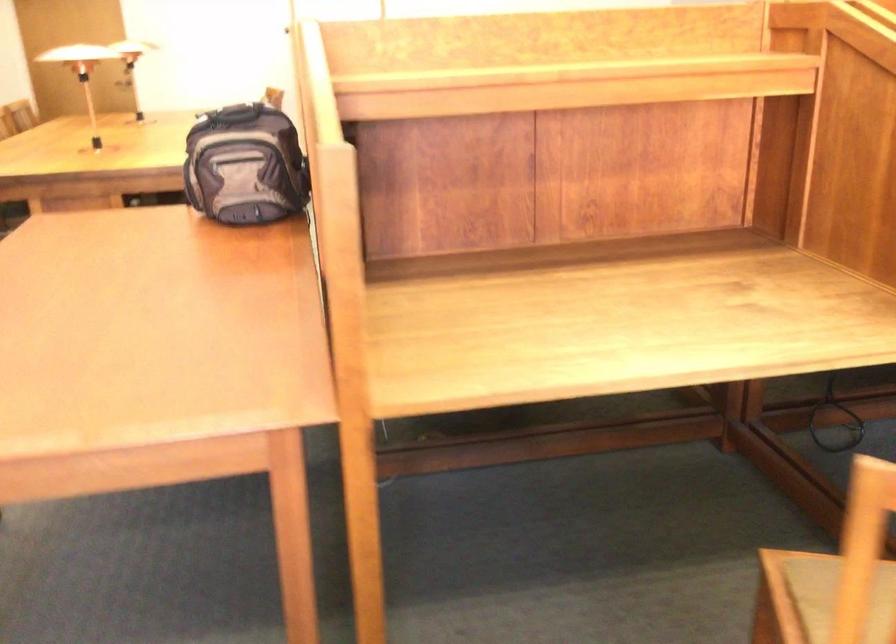
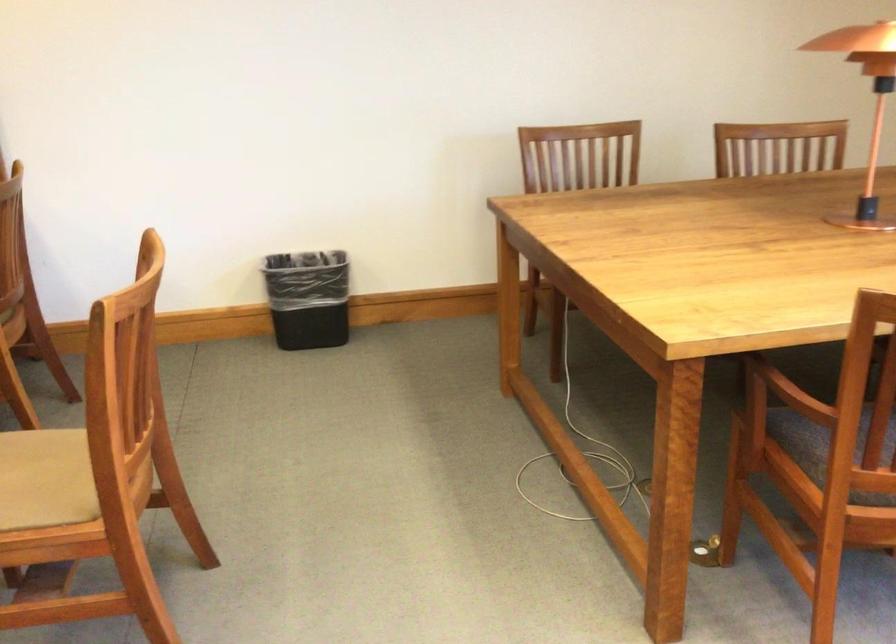
Question: The camera is either moving clockwise (left) or counter-clockwise (right) around the object. The first image is from the beginning of the video and the second image is from the end. Is the camera moving left or right when shooting the video?

Choices:
 (A) Left
 (B) Right

Answer: (A)